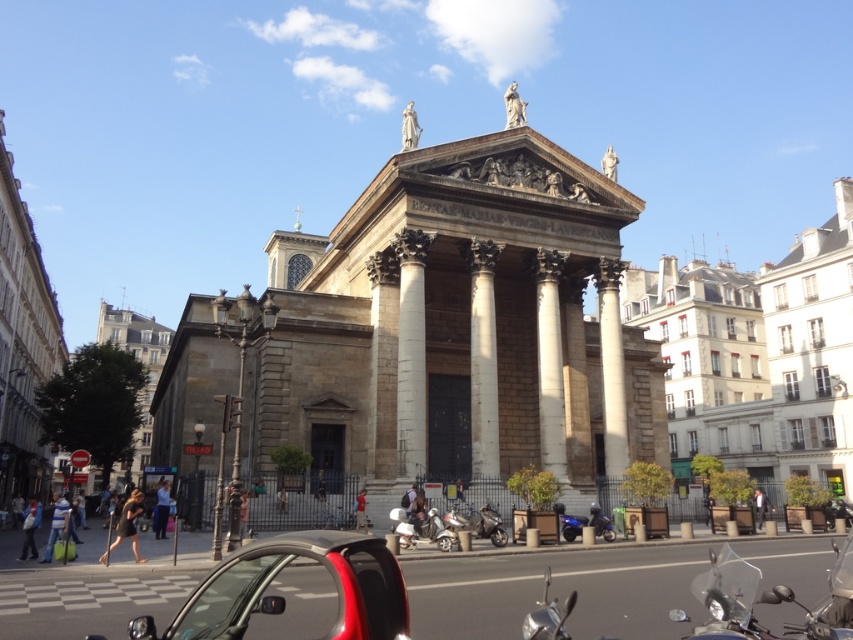
Question: Is the position of shiny red car at lower center less distant than that of shiny chrome motorcycle at lower center?

Choices:
 (A) yes
 (B) no

Answer: (A)

Question: Does metallic silver scooter at center have a smaller size compared to shiny blue motorcycle at lower center?

Choices:
 (A) no
 (B) yes

Answer: (A)

Question: Can you confirm if shiny chrome motorcycle at lower right is positioned below shiny blue motorcycle at lower center?

Choices:
 (A) no
 (B) yes

Answer: (A)

Question: Which point appears closest to the camera in this image?

Choices:
 (A) (563, 522)
 (B) (431, 540)
 (C) (273, 589)
 (D) (456, 515)

Answer: (C)

Question: Which of the following is the farthest from the observer?

Choices:
 (A) 369,554
 (B) 751,580
 (C) 500,544

Answer: (C)

Question: Which object is closer to the camera taking this photo?

Choices:
 (A) shiny chrome motorcycle at lower right
 (B) metallic silver scooter at center

Answer: (A)